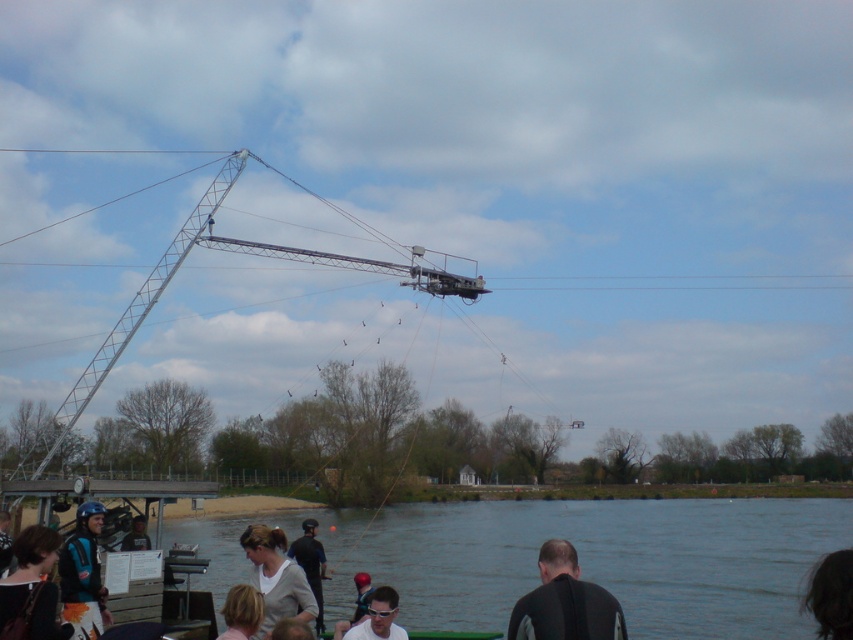
You are standing at the crane structure and want to move towards the water edge. You have two points marked on the ground, point A at point (590, 636) and point B at point (44, 602). Which point should you walk towards to reach the water edge faster?

Point A at point (590, 636) is closer to the viewer than point B at point (44, 602), so walking towards point A would allow you to reach the water edge faster.

You are a photographer trying to capture a clear shot of the black wetsuit at lower center and the dark brown leather jacket at lower left. Since you want to focus on the details of both items, which one might require a closer shot to see its texture clearly?

Result: The black wetsuit at lower center is thinner than the dark brown leather jacket at lower left, so the black wetsuit at lower center might require a closer shot to see its texture clearly because thinner materials may have finer details that are harder to discern from a distance.